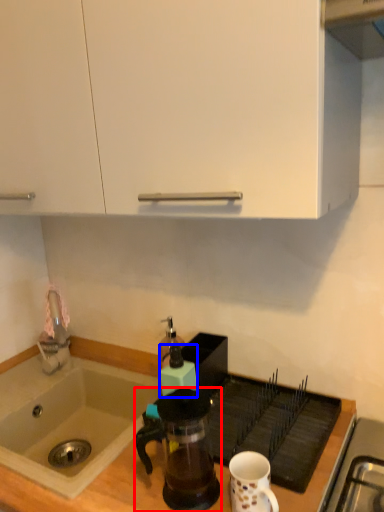
Question: Which point is closer to the camera, coffee maker (highlighted by a red box) or kitchen appliance (highlighted by a blue box)?

Choices:
 (A) coffee maker
 (B) kitchen appliance

Answer: (A)